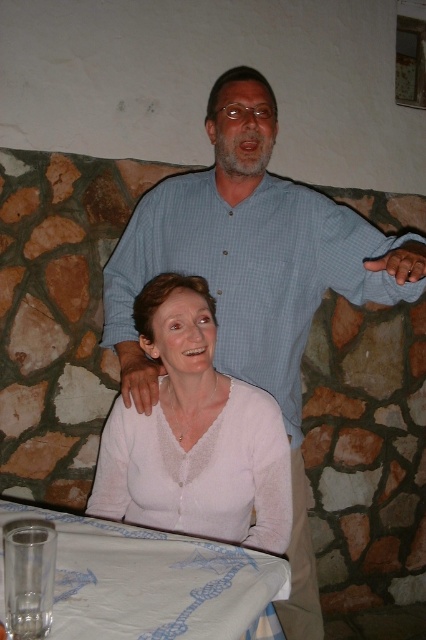
You are a photographer trying to capture a candid shot of both the light blue checkered shirt at upper center and the transparent glass at lower left. Since you want to ensure both are in focus, you need to know their heights. Which object is taller?

The light blue checkered shirt at upper center is much taller than the transparent glass at lower left, so you should focus on the height of the light blue checkered shirt at upper center to ensure both are in focus.

You are standing in front of the table and want to place a small vase exactly at the point marked as point [195,435]. What object is located at that point?

The point [195,435] corresponds to the white sheer blouse at center, so placing the vase there would place it directly on top of the white sheer blouse at center.